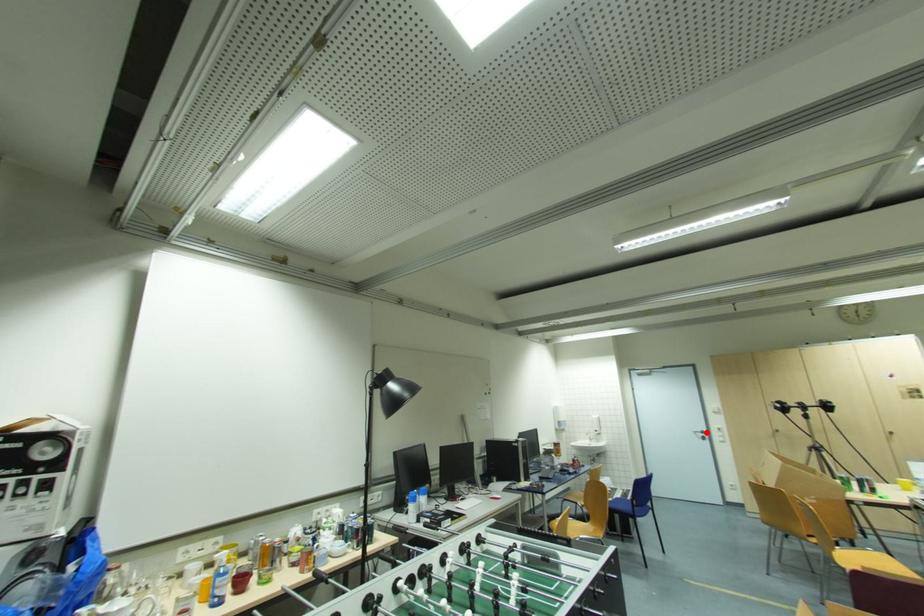
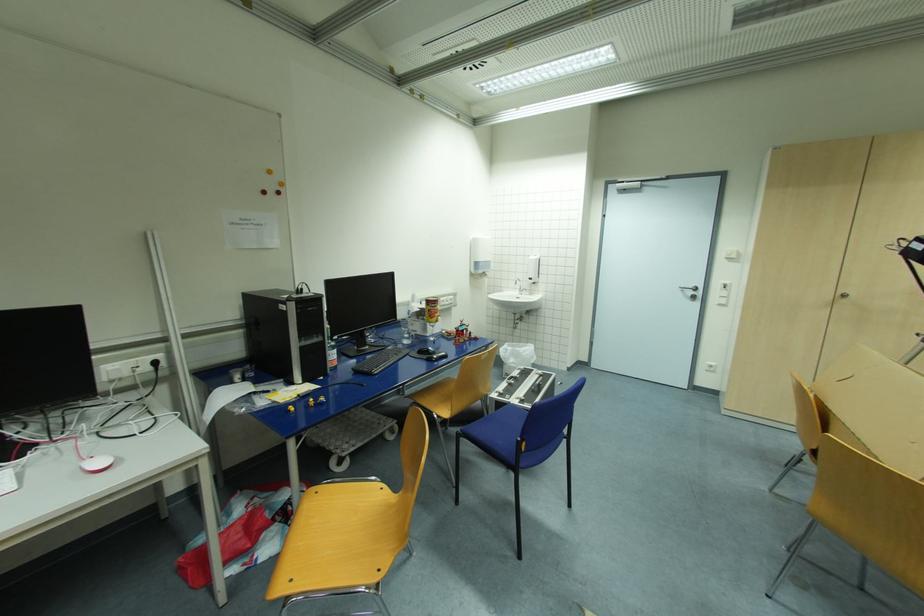
Where in the second image is the point corresponding to the highlighted location from the first image?

(699, 289)